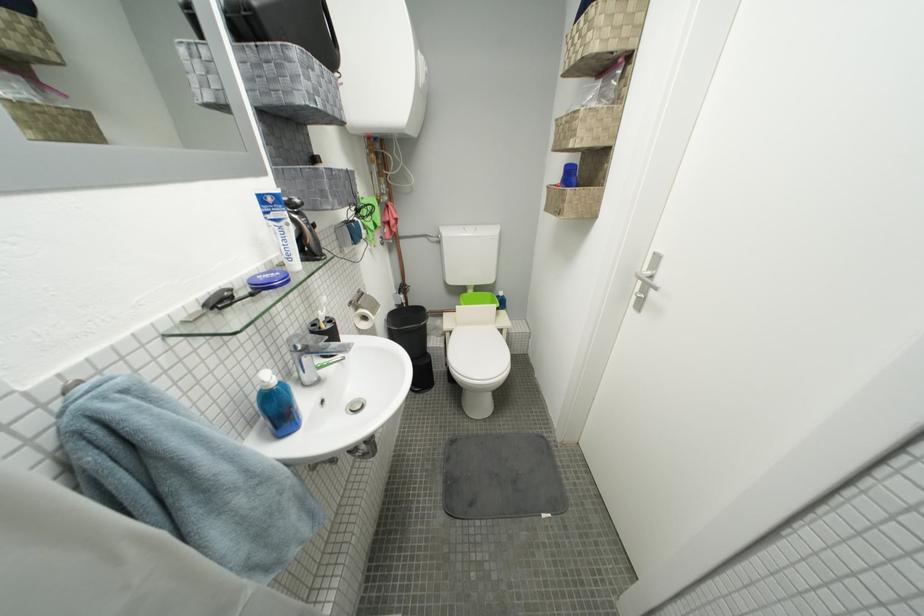
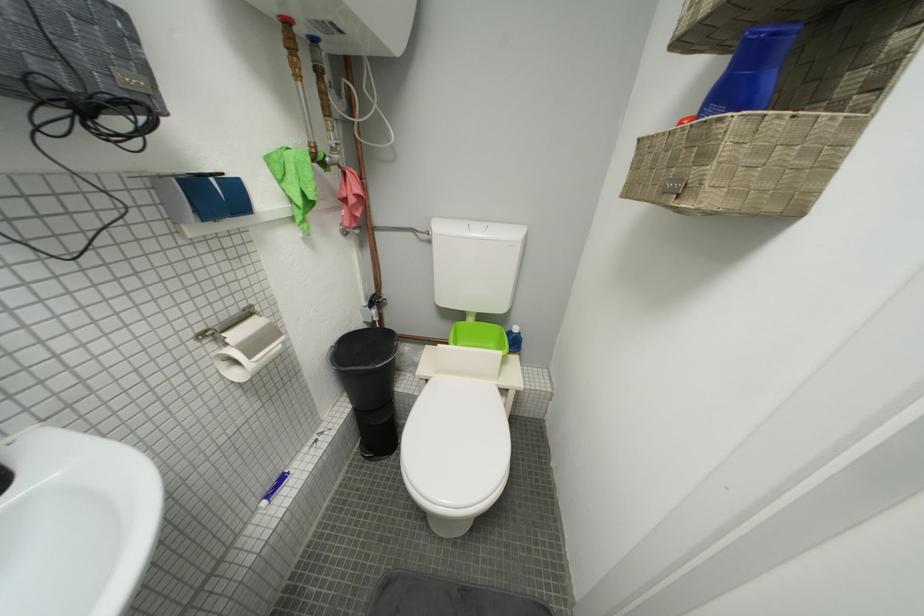
Question: Based on the continuous images, in which direction is the camera rotating? Reply with the corresponding letter.

Choices:
 (A) Left
 (B) Right
 (C) Up
 (D) Down

Answer: (A)